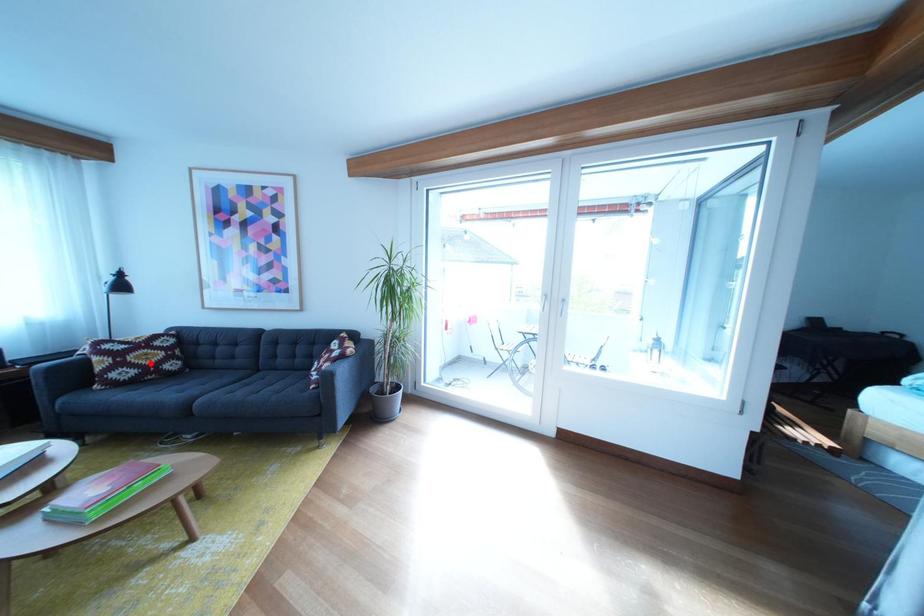
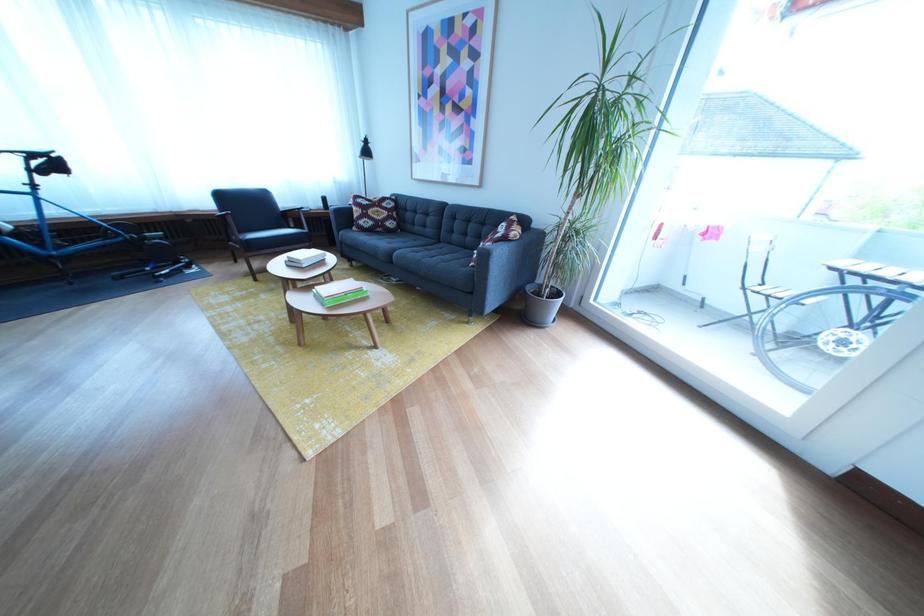
Where in the second image is the point corresponding to the highlighted location from the first image?

(386, 219)